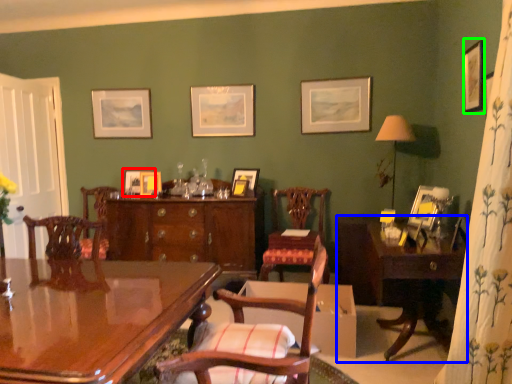
Question: Based on their relative distances, which object is nearer to picture frame (highlighted by a red box)? Choose from table (highlighted by a blue box) and picture frame (highlighted by a green box).

Choices:
 (A) table
 (B) picture frame

Answer: (A)